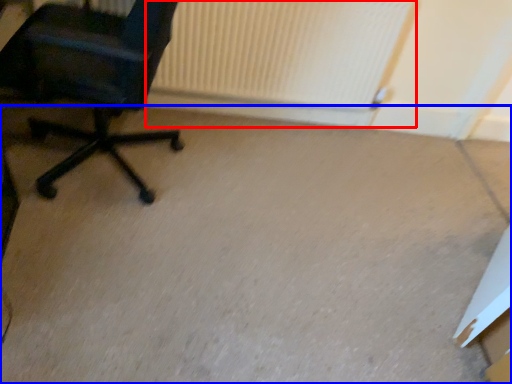
Question: Which object is closer to the camera taking this photo, radiator (highlighted by a red box) or concrete (highlighted by a blue box)?

Choices:
 (A) radiator
 (B) concrete

Answer: (B)